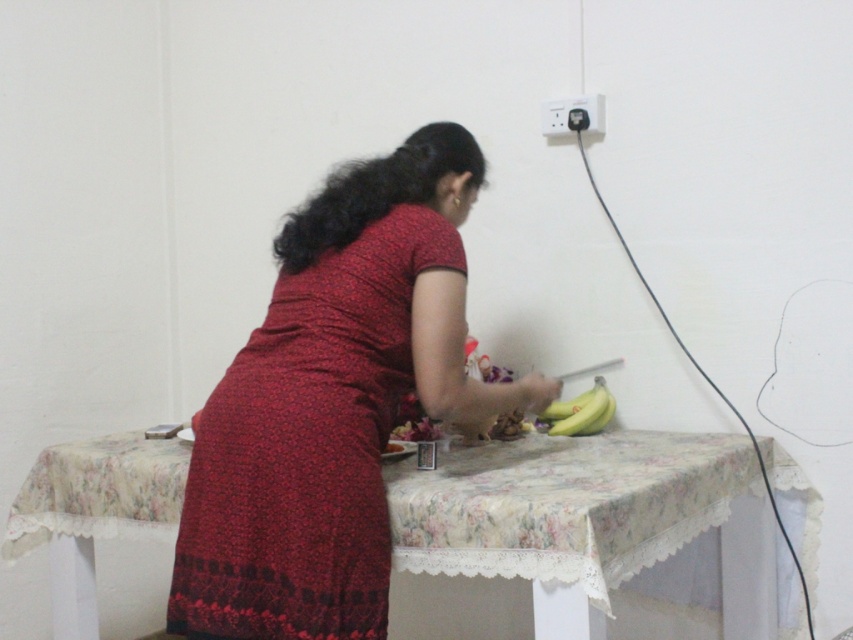
Can you confirm if floral fabric table at center is shorter than yellow matte bananas at center?

No.

Is floral fabric table at center thinner than yellow matte bananas at center?

In fact, floral fabric table at center might be wider than yellow matte bananas at center.

Is point (599, 440) less distant than point (611, 413)?

Yes, point (599, 440) is closer to viewer.

Image resolution: width=853 pixels, height=640 pixels. In order to click on floral fabric table at center in this screenshot , I will do `click(566, 506)`.

Between yellow matte bananas at center and white plastic electric outlet at upper center, which one appears on the left side from the viewer's perspective?

white plastic electric outlet at upper center

Is point (601, 406) positioned behind point (596, 116)?

No, (601, 406) is closer to viewer.

Between point (583, 428) and point (577, 100), which one is positioned in front?

Point (583, 428) is more forward.

This screenshot has width=853, height=640. I want to click on yellow matte bananas at center, so click(579, 412).

Is floral fabric table at center thinner than white plastic electric outlet at upper center?

No.

Is point (51, 481) farther from camera compared to point (552, 122)?

No.

Find the location of a particular element. The image size is (853, 640). floral fabric table at center is located at coordinates (566, 506).